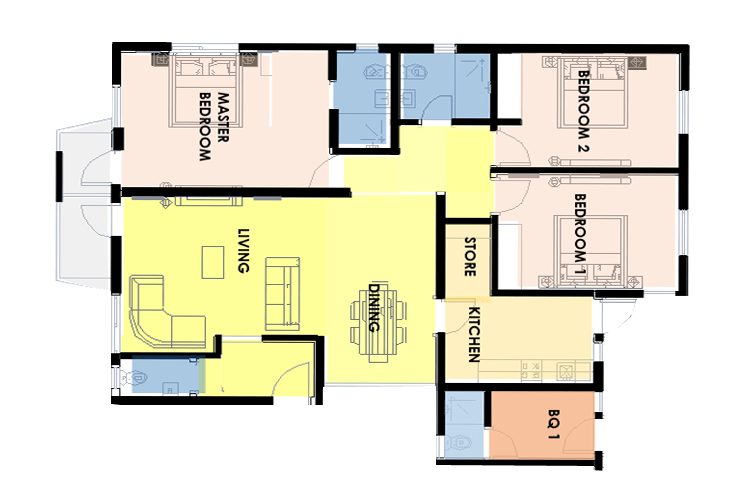
Find the location of a particular element. The image size is (750, 500). double bed is located at coordinates (187, 101).